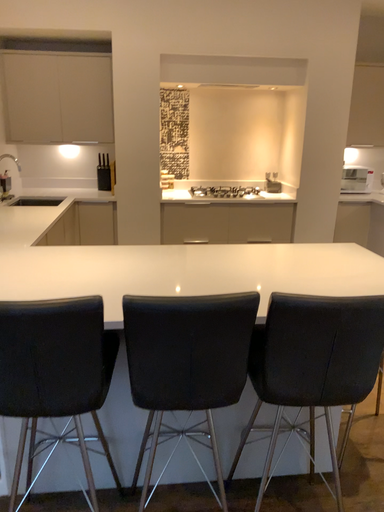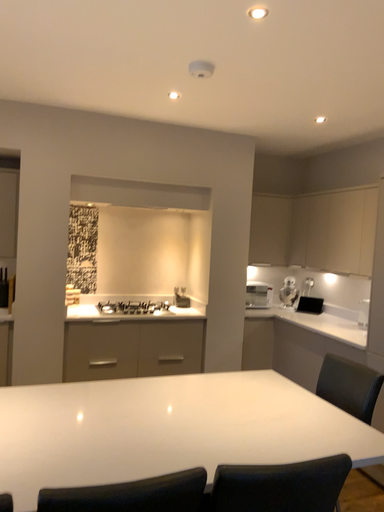
Question: How did the camera likely rotate when shooting the video?

Choices:
 (A) rotated downward
 (B) rotated upward

Answer: (B)